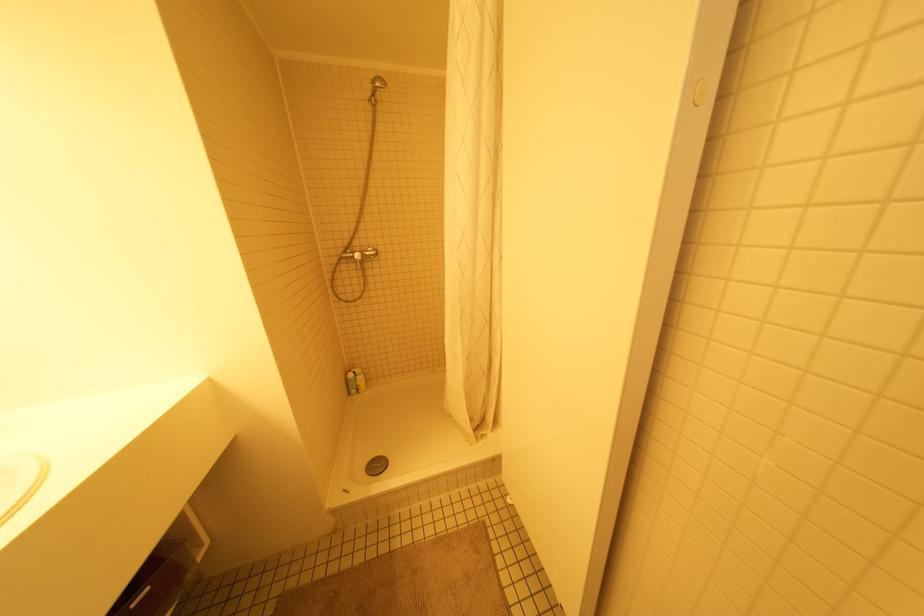
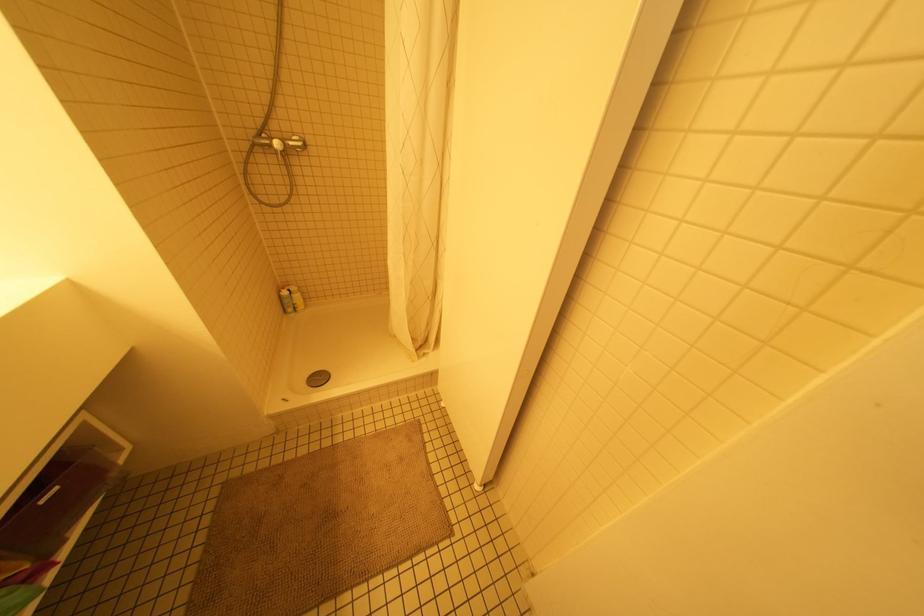
Locate, in the second image, the point that corresponds to the point at 357,254 in the first image.

(276, 144)